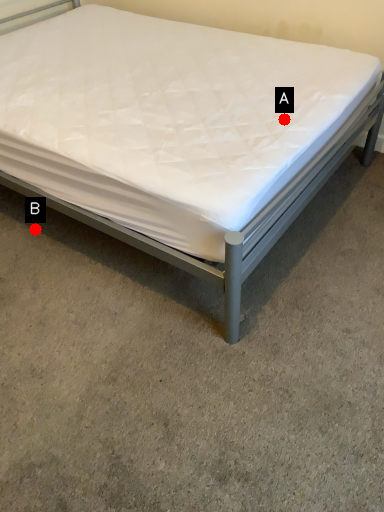
Question: Two points are circled on the image, labeled by A and B beside each circle. Which of the following is the farthest from the observer?

Choices:
 (A) A is further
 (B) B is further

Answer: (B)